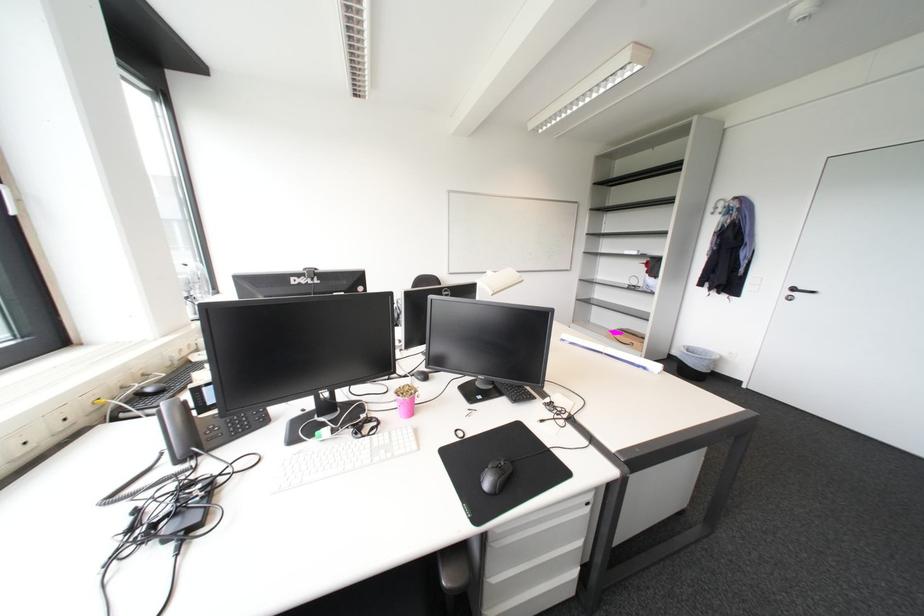
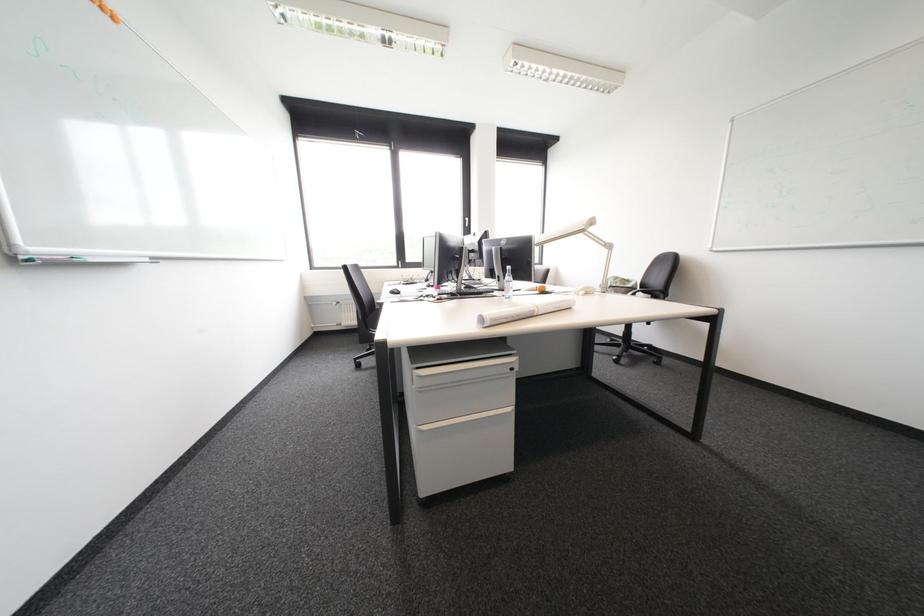
Question: I am providing you with two images of the same scene from different viewpoints. Please identify which objects are invisible in image2.

Choices:
 (A) black power hub
 (B) rolled up paper
 (C) chair armrest
 (D) top drawer handle

Answer: (C)